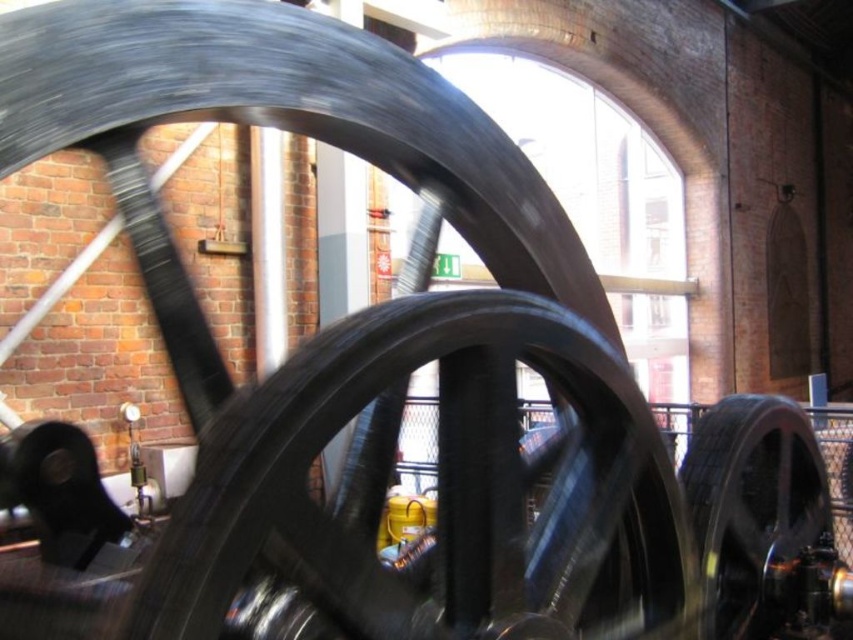
Is black matte wheel at center wider than shiny black wheel at center?

Correct, the width of black matte wheel at center exceeds that of shiny black wheel at center.

In the scene shown: Between black matte wheel at center and shiny black wheel at center, which one appears on the left side from the viewer's perspective?

From the viewer's perspective, black matte wheel at center appears more on the left side.

The image size is (853, 640). What do you see at coordinates (442, 484) in the screenshot? I see `black matte wheel at center` at bounding box center [442, 484].

The image size is (853, 640). What are the coordinates of `black matte wheel at center` in the screenshot? It's located at (442, 484).